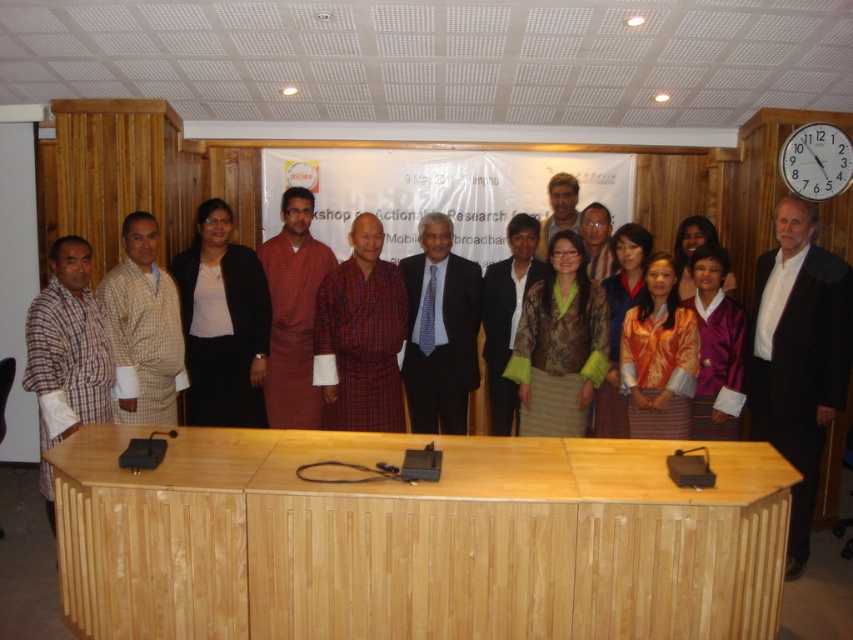
Is checkered fabric shirt at left taller than orange silk blouse at center?

Yes, checkered fabric shirt at left is taller than orange silk blouse at center.

Between checkered fabric shirt at left and orange silk blouse at center, which one has more height?

checkered fabric shirt at left is taller.

Is point (148, 246) farther from camera compared to point (643, 333)?

Yes, it is behind point (643, 333).

In order to click on checkered fabric shirt at left in this screenshot , I will do `click(143, 328)`.

Is plaid fabric shirt at left bigger than white plastic clock at upper right?

Indeed, plaid fabric shirt at left has a larger size compared to white plastic clock at upper right.

Who is more distant from viewer, (85, 362) or (851, 150)?

The point (851, 150) is behind.

Is point (55, 416) farther from camera compared to point (833, 141)?

That is False.

Identify the location of plaid fabric shirt at left. (67, 346).

Find the location of a particular element. green textured jacket at center is located at coordinates (560, 344).

Measure the distance from green textured jacket at center to matte purple dress at center.

They are 69.88 centimeters apart.

What do you see at coordinates (560, 344) in the screenshot? The width and height of the screenshot is (853, 640). I see `green textured jacket at center` at bounding box center [560, 344].

At what (x,y) coordinates should I click in order to perform the action: click on green textured jacket at center. Please return your answer as a coordinate pair (x, y). The width and height of the screenshot is (853, 640). Looking at the image, I should click on (560, 344).